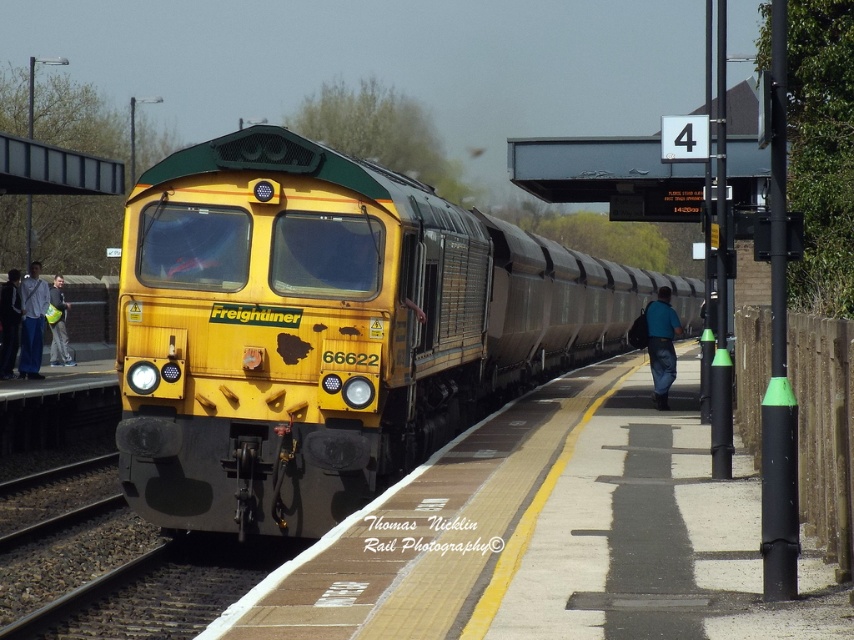
You are standing at the railway station platform and want to take a photo of the yellow matte freightliner at center and the denim jacket at left. Which object should you focus on first if you want both to be in clear focus?

The yellow matte freightliner at center is closer to the viewer than the denim jacket at left, so you should focus on the yellow matte freightliner at center first to ensure both are in clear focus.

You are a photographer standing at the railway station platform. You want to capture a photo of the yellow matte freightliner at center and the light gray fabric jacket at left in the same frame. Considering their sizes, which object will appear larger in the photo?

The yellow matte freightliner at center will appear larger in the photo because its width surpasses that of the light gray fabric jacket at left.